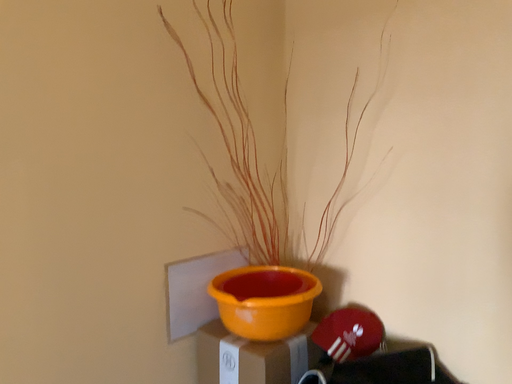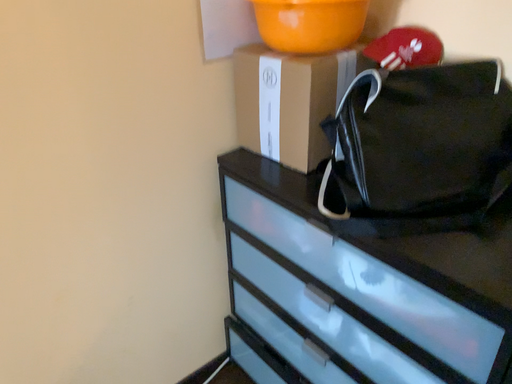
Question: Which way did the camera rotate in the video?

Choices:
 (A) rotated upward
 (B) rotated downward

Answer: (B)